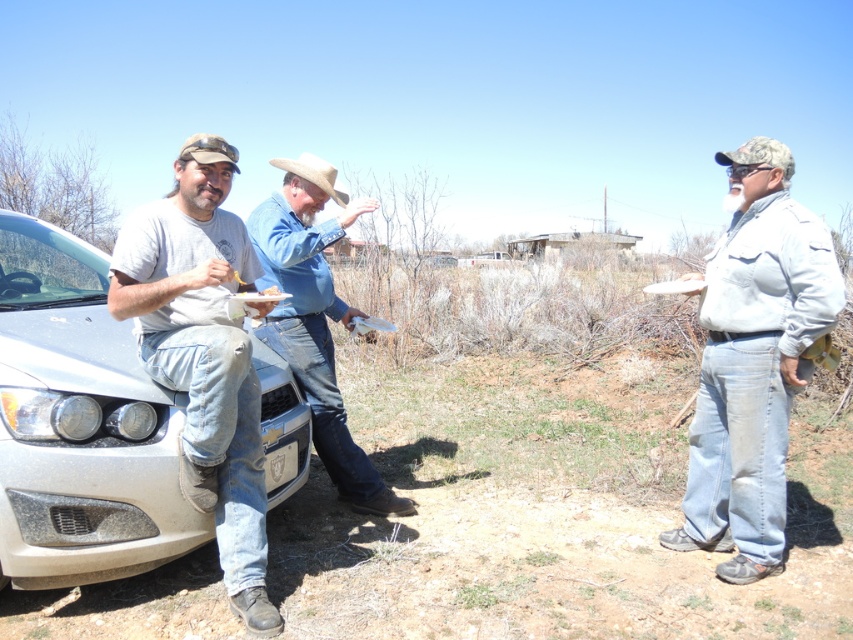
Question: Does denim jacket at right appear under beige felt cowboy hat at center?

Choices:
 (A) yes
 (B) no

Answer: (A)

Question: Which object is farther from the camera taking this photo?

Choices:
 (A) denim jacket at right
 (B) blue denim jeans at center

Answer: (B)

Question: Which object is closer to the camera taking this photo?

Choices:
 (A) beige felt cowboy hat at center
 (B) blue denim jeans at center

Answer: (B)

Question: Is silver metallic car at left wider than blue denim jeans at center?

Choices:
 (A) no
 (B) yes

Answer: (B)

Question: Which object is farther from the camera taking this photo?

Choices:
 (A) silver metallic car at left
 (B) denim jacket at right
 (C) beige felt cowboy hat at center
 (D) blue denim jeans at center

Answer: (C)

Question: Considering the relative positions of silver metallic car at left and denim jacket at right in the image provided, where is silver metallic car at left located with respect to denim jacket at right?

Choices:
 (A) left
 (B) right

Answer: (A)